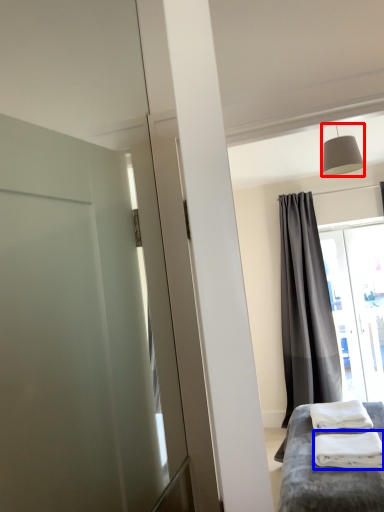
Question: Which object appears farthest to the camera in this image, light fixture (highlighted by a red box) or material (highlighted by a blue box)?

Choices:
 (A) light fixture
 (B) material

Answer: (A)